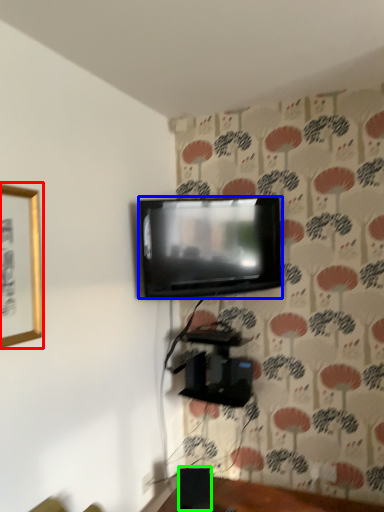
Question: Based on their relative distances, which object is farther from picture frame (highlighted by a red box)? Choose from television (highlighted by a blue box) and speaker (highlighted by a green box).

Choices:
 (A) television
 (B) speaker

Answer: (B)